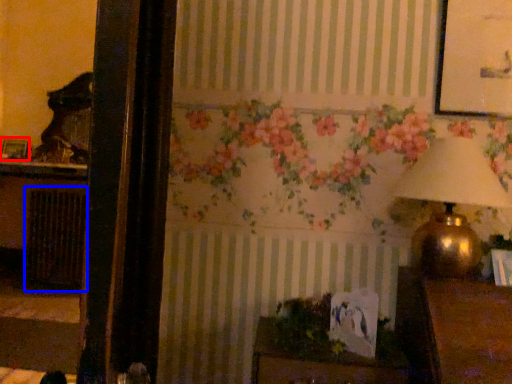
Question: Which of the following is the farthest to the observer, picture frame (highlighted by a red box) or radiator (highlighted by a blue box)?

Choices:
 (A) picture frame
 (B) radiator

Answer: (A)